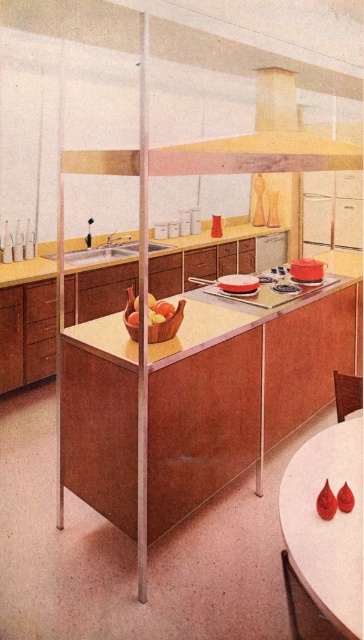
Which is behind, point (104, 364) or point (232, 228)?

Point (232, 228)

Between wooden table at center and yellow laminate countertop at center, which one is positioned higher?

yellow laminate countertop at center is above.

Does point (214, 454) lie behind point (247, 225)?

No.

Find the location of `wooden table at center`. wooden table at center is located at coordinates (242, 387).

Is yellow laminate countertop at center wider than shiny golden apples at center?

Yes, yellow laminate countertop at center is wider than shiny golden apples at center.

Which is more to the left, yellow laminate countertop at center or shiny golden apples at center?

From the viewer's perspective, yellow laminate countertop at center appears more on the left side.

Is point (191, 236) closer to camera compared to point (161, 317)?

No, it is behind (161, 317).

Locate an element on the screen. yellow laminate countertop at center is located at coordinates (214, 237).

Does white glossy round table at lower right have a lesser width compared to satin nickel sink at center?

Indeed, white glossy round table at lower right has a lesser width compared to satin nickel sink at center.

What are the coordinates of `white glossy round table at lower right` in the screenshot? It's located at (323, 536).